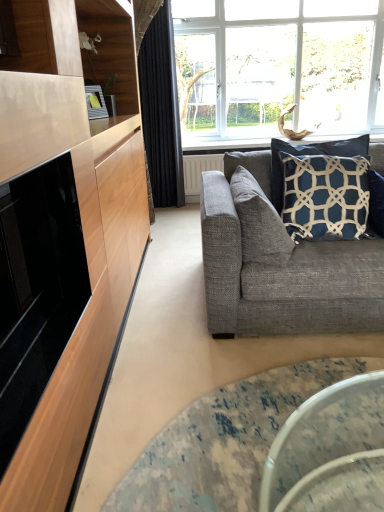
Identify the location of clear glass window at upper center. The height and width of the screenshot is (512, 384). (277, 67).

Measure the distance between point (237, 287) and camera.

The depth of point (237, 287) is 1.88 meters.

What do you see at coordinates (283, 271) in the screenshot? Image resolution: width=384 pixels, height=512 pixels. I see `textured gray couch at right` at bounding box center [283, 271].

Image resolution: width=384 pixels, height=512 pixels. In order to click on textured gray pillow at right, the second pillow in the right-to-left sequence in this screenshot , I will do `click(259, 222)`.

From a real-world perspective, is black velvet curtain at upper center above or below black glossy microwave at left?

In terms of real-world spatial position, black velvet curtain at upper center is above black glossy microwave at left.

Would you consider black velvet curtain at upper center to be distant from black glossy microwave at left?

Yes, black velvet curtain at upper center and black glossy microwave at left are located far from each other.

Is black glossy microwave at left inside black velvet curtain at upper center?

No, black glossy microwave at left is not inside black velvet curtain at upper center.

Considering the sizes of objects black velvet curtain at upper center and black glossy microwave at left in the image provided, who is taller, black velvet curtain at upper center or black glossy microwave at left?

Standing taller between the two is black velvet curtain at upper center.

Does point (181, 24) come behind point (318, 201)?

Yes, it is.

Which object is positioned more to the right, clear glass window at upper center or navy blue fabric pillow at upper right, the second pillow from the left?

clear glass window at upper center is more to the right.

Does clear glass window at upper center have a smaller size compared to navy blue fabric pillow at upper right, the second pillow from the left?

No.

Is clear glass window at upper center wider or thinner than navy blue fabric pillow at upper right, the second pillow from the left?

Clearly, clear glass window at upper center has more width compared to navy blue fabric pillow at upper right, the second pillow from the left.

Which is closer, (357, 89) or (134, 476)?

Clearly, point (357, 89) is more distant from the camera than point (134, 476).

Is translucent glass coffee table at lower center located within clear glass window at upper center?

No, translucent glass coffee table at lower center is not inside clear glass window at upper center.

Which is more to the left, clear glass window at upper center or translucent glass coffee table at lower center?

translucent glass coffee table at lower center.

Is clear glass window at upper center oriented away from translucent glass coffee table at lower center?

No, clear glass window at upper center is not facing away from translucent glass coffee table at lower center.

Considering the positions of objects textured gray couch at right and black velvet curtain at upper center in the image provided, who is more to the left, textured gray couch at right or black velvet curtain at upper center?

Positioned to the left is black velvet curtain at upper center.

What's the angular difference between textured gray couch at right and black velvet curtain at upper center's facing directions?

They differ by 0.362 degrees in their facing directions.

Does point (227, 181) lie behind point (174, 109)?

That is False.

Is textured gray couch at right with black velvet curtain at upper center?

No.

Looking at this image, can you confirm if translucent glass coffee table at lower center is positioned to the left of clear glass window at upper center?

Yes.

From the image's perspective, which is below, translucent glass coffee table at lower center or clear glass window at upper center?

translucent glass coffee table at lower center appears lower in the image.

Between translucent glass coffee table at lower center and clear glass window at upper center, which one has smaller width?

clear glass window at upper center is thinner.

The image size is (384, 512). I want to click on curtain above the textured gray pillow at right, placed as the 1th pillow when sorted from left to right (from the image's perspective), so click(x=159, y=102).

Between black velvet curtain at upper center and textured gray pillow at right, placed as the 1th pillow when sorted from left to right, which one has less height?

textured gray pillow at right, placed as the 1th pillow when sorted from left to right.

From a real-world perspective, is black velvet curtain at upper center located higher than textured gray pillow at right, placed as the 1th pillow when sorted from left to right?

Yes, from a real-world perspective, black velvet curtain at upper center is on top of textured gray pillow at right, placed as the 1th pillow when sorted from left to right.

Is black velvet curtain at upper center positioned with its back to textured gray pillow at right, placed as the 1th pillow when sorted from left to right?

No, black velvet curtain at upper center is not facing away from textured gray pillow at right, placed as the 1th pillow when sorted from left to right.

Is textured gray couch at right oriented towards translucent glass coffee table at lower center?

Yes, textured gray couch at right faces towards translucent glass coffee table at lower center.

Which object is more forward, textured gray couch at right or translucent glass coffee table at lower center?

translucent glass coffee table at lower center.

Considering the relative sizes of textured gray couch at right and translucent glass coffee table at lower center in the image provided, is textured gray couch at right thinner than translucent glass coffee table at lower center?

Incorrect, the width of textured gray couch at right is not less than that of translucent glass coffee table at lower center.

From the image's perspective, is textured gray couch at right under translucent glass coffee table at lower center?

No.

At what (x,y) coordinates should I click in order to perform the action: click on curtain located behind the black glossy microwave at left. Please return your answer as a coordinate pair (x, y). Looking at the image, I should click on (159, 102).

Where is `the 1st pillow to the left of the clear glass window at upper center, starting your count from the anchor`? the 1st pillow to the left of the clear glass window at upper center, starting your count from the anchor is located at coordinates (325, 196).

Considering their positions, is textured gray couch at right positioned further to translucent glass coffee table at lower center than navy blue fabric pillow at upper right, the second pillow from the left?

navy blue fabric pillow at upper right, the second pillow from the left, is further to translucent glass coffee table at lower center.

Based on their spatial positions, is black velvet curtain at upper center or black glossy microwave at left closer to navy blue fabric pillow at upper right, the second pillow from the left?

Among the two, black glossy microwave at left is located nearer to navy blue fabric pillow at upper right, the second pillow from the left.

Which object lies further to the anchor point clear glass window at upper center, textured gray pillow at right, placed as the 1th pillow when sorted from left to right, or navy blue fabric pillow at upper right, arranged as the 1th pillow when viewed from the right?

textured gray pillow at right, placed as the 1th pillow when sorted from left to right, is further to clear glass window at upper center.

Considering their positions, is black velvet curtain at upper center positioned further to textured gray pillow at right, placed as the 1th pillow when sorted from left to right, than clear glass window at upper center?

The object further to textured gray pillow at right, placed as the 1th pillow when sorted from left to right, is clear glass window at upper center.

Looking at the image, which one is located further to translucent glass coffee table at lower center, black glossy microwave at left or navy blue fabric pillow at upper right, the second pillow from the left?

Among the two, navy blue fabric pillow at upper right, the second pillow from the left, is located further to translucent glass coffee table at lower center.

When comparing their distances from black glossy microwave at left, does textured gray pillow at right, placed as the 1th pillow when sorted from left to right, or navy blue fabric pillow at upper right, the second pillow from the left, seem further?

navy blue fabric pillow at upper right, the second pillow from the left.

Based on their spatial positions, is black velvet curtain at upper center or translucent glass coffee table at lower center closer to clear glass window at upper center?

black velvet curtain at upper center lies closer to clear glass window at upper center than the other object.

From the image, which object appears to be farther from translucent glass coffee table at lower center, textured gray pillow at right, placed as the 1th pillow when sorted from left to right, or navy blue fabric pillow at upper right, arranged as the 1th pillow when viewed from the right?

navy blue fabric pillow at upper right, arranged as the 1th pillow when viewed from the right, is positioned further to the anchor translucent glass coffee table at lower center.

Where is `coffee table located between black glossy microwave at left and black velvet curtain at upper center in the depth direction`? This screenshot has height=512, width=384. coffee table located between black glossy microwave at left and black velvet curtain at upper center in the depth direction is located at coordinates (225, 441).

Where is `curtain between black glossy microwave at left and clear glass window at upper center in the front-back direction`? curtain between black glossy microwave at left and clear glass window at upper center in the front-back direction is located at coordinates (159, 102).

This screenshot has width=384, height=512. In order to click on curtain between translucent glass coffee table at lower center and clear glass window at upper center in the front-back direction in this screenshot , I will do `click(159, 102)`.

The width and height of the screenshot is (384, 512). I want to click on coffee table positioned between black glossy microwave at left and navy blue fabric pillow at upper right, arranged as the 1th pillow when viewed from the right, from near to far, so click(225, 441).